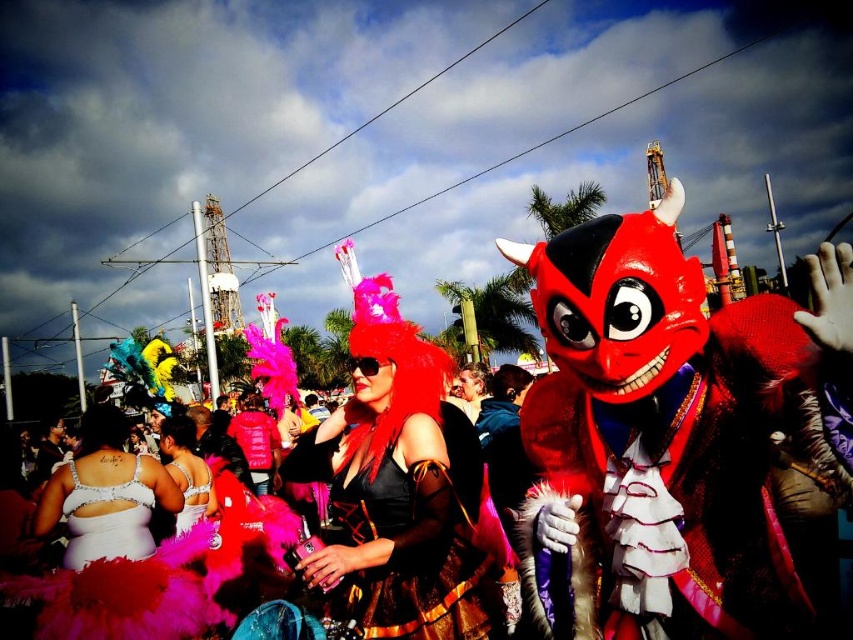
Does furry costume at center appear on the right side of shiny red devil mask at center?

Incorrect, furry costume at center is not on the right side of shiny red devil mask at center.

Is point (688, 380) positioned after point (846, 428)?

Yes, it is.

Between point (839, 390) and point (747, 592), which one is positioned in front?

Positioned in front is point (839, 390).

The image size is (853, 640). In order to click on furry costume at center in this screenshot , I will do point(672,435).

The image size is (853, 640). What do you see at coordinates (672, 435) in the screenshot?
I see `furry costume at center` at bounding box center [672, 435].

Does furry costume at center have a smaller size compared to fuzzy pink boa at center?

Incorrect, furry costume at center is not smaller in size than fuzzy pink boa at center.

Does point (756, 440) lie in front of point (437, 554)?

Yes.

Locate an element on the screen. The image size is (853, 640). furry costume at center is located at coordinates (672, 435).

This screenshot has width=853, height=640. I want to click on satin silver dress at lower left, so click(187, 472).

What do you see at coordinates (187, 472) in the screenshot? This screenshot has width=853, height=640. I see `satin silver dress at lower left` at bounding box center [187, 472].

Locate an element on the screen. Image resolution: width=853 pixels, height=640 pixels. satin silver dress at lower left is located at coordinates click(187, 472).